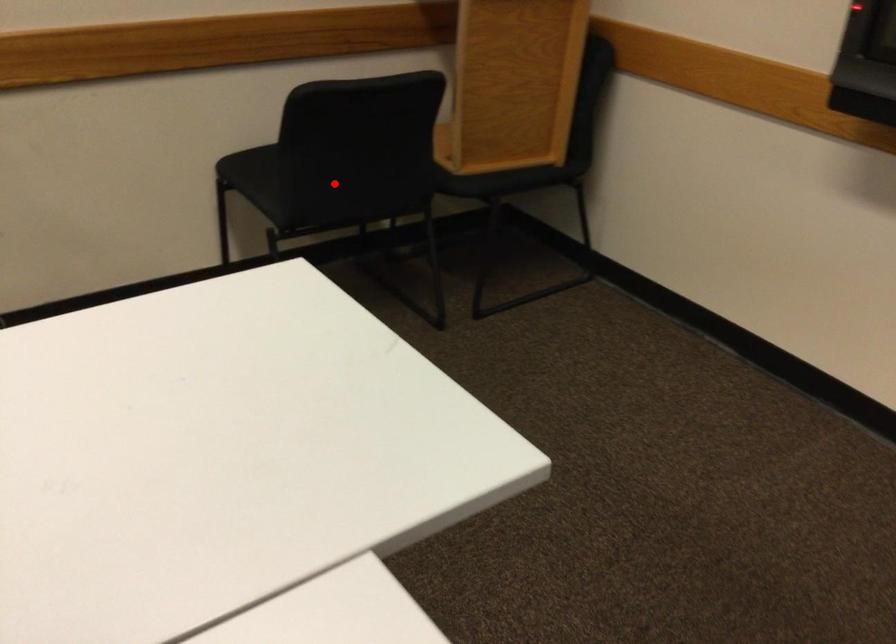
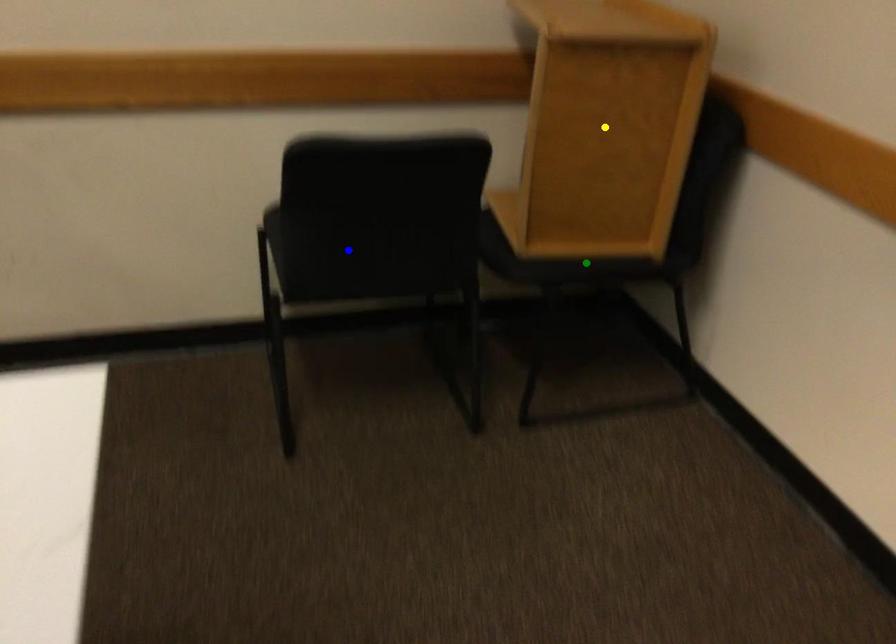
Question: I am providing you with two images of the same scene from different viewpoints. A red point is marked on the first image. You are given multiple points on the second image. Which point in image 2 represents the same 3d spot as the red point in image 1?

Choices:
 (A) blue point
 (B) green point
 (C) yellow point

Answer: (A)